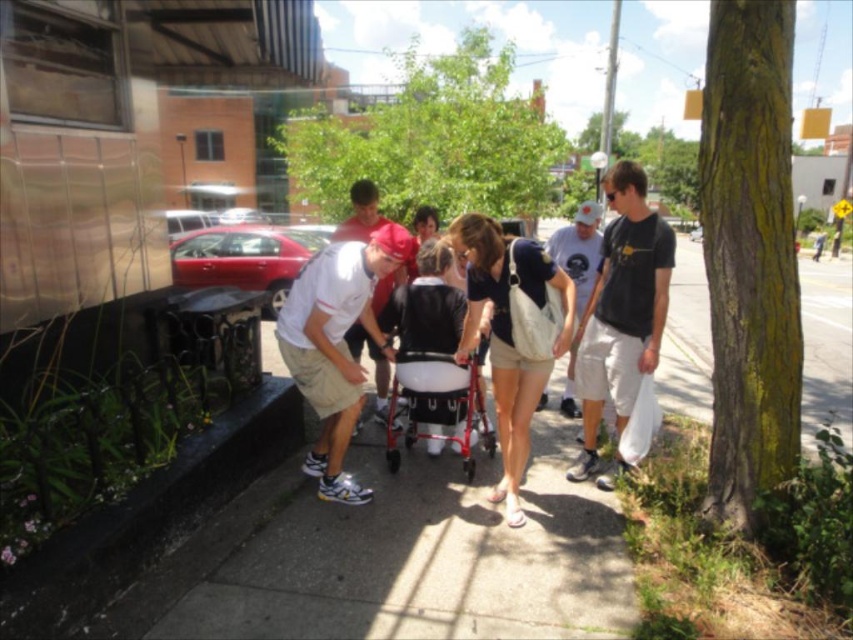
Between black concrete curb at lower left and white matte shirt at center, which one is positioned lower?

black concrete curb at lower left is below.

Is point (299, 404) positioned in front of point (347, 348)?

No, (299, 404) is further to viewer.

Does point (242, 429) come behind point (326, 339)?

Yes, it is behind point (326, 339).

You are a GUI agent. You are given a task and a screenshot of the screen. Output one action in this format:
    pyautogui.click(x=<x>, y=<y>)
    Task: Click on the black concrete curb at lower left
    The image size is (853, 640).
    Given the screenshot: What is the action you would take?
    pyautogui.click(x=149, y=516)

Is the position of matte black t-shirt at right less distant than that of light blue jeans at center?

Yes.

Does matte black t-shirt at right have a smaller size compared to light blue jeans at center?

Indeed, matte black t-shirt at right has a smaller size compared to light blue jeans at center.

The width and height of the screenshot is (853, 640). Describe the element at coordinates (621, 308) in the screenshot. I see `matte black t-shirt at right` at that location.

Identify the location of matte black t-shirt at right. The height and width of the screenshot is (640, 853). (621, 308).

Who is lower down, white matte shirt at center or beige canvas bag at center?

beige canvas bag at center

Does white matte shirt at center have a lesser height compared to beige canvas bag at center?

Incorrect, white matte shirt at center's height does not fall short of beige canvas bag at center's.

You are a GUI agent. You are given a task and a screenshot of the screen. Output one action in this format:
    pyautogui.click(x=<x>, y=<y>)
    Task: Click on the white matte shirt at center
    
    Given the screenshot: What is the action you would take?
    pyautogui.click(x=335, y=344)